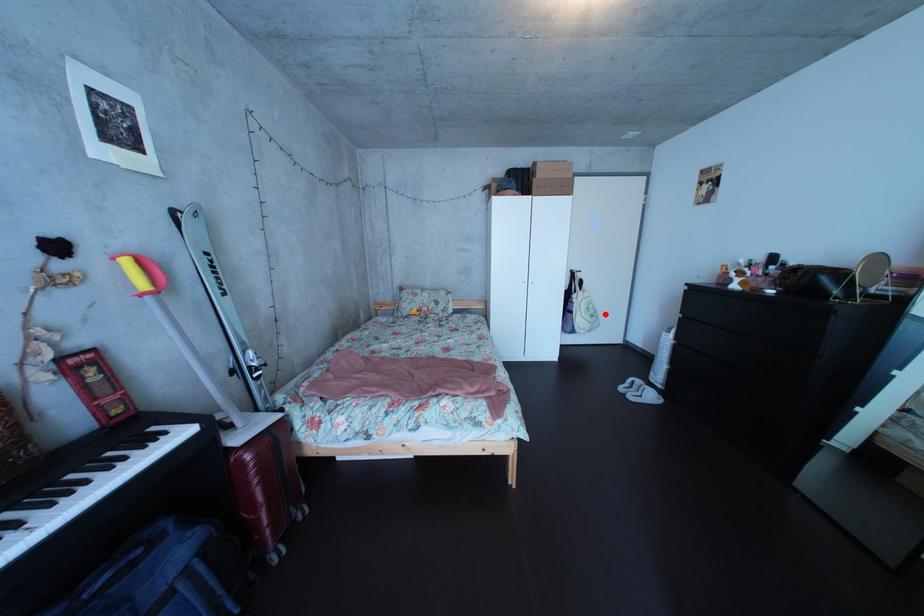
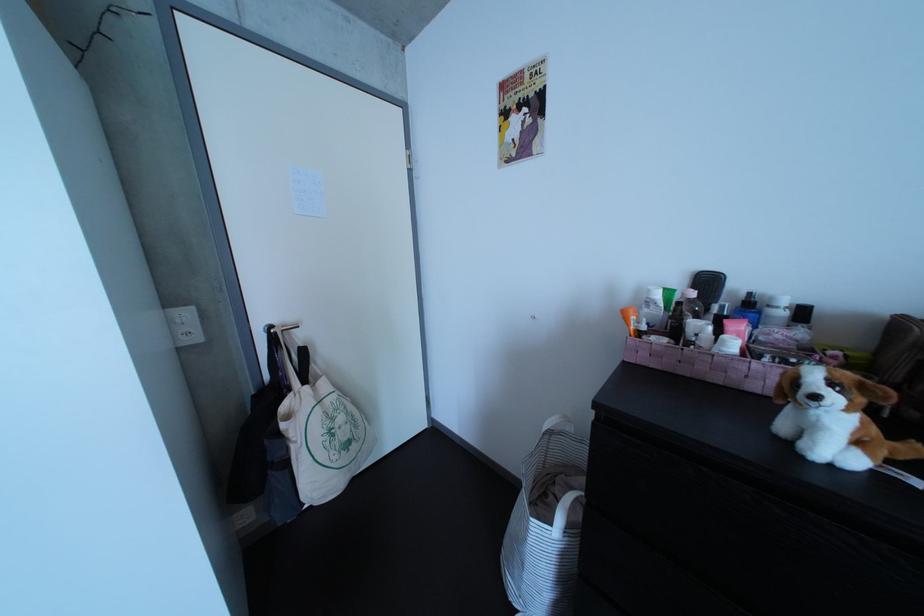
Where in the second image is the point corresponding to the highlighted location from the first image?

(355, 426)